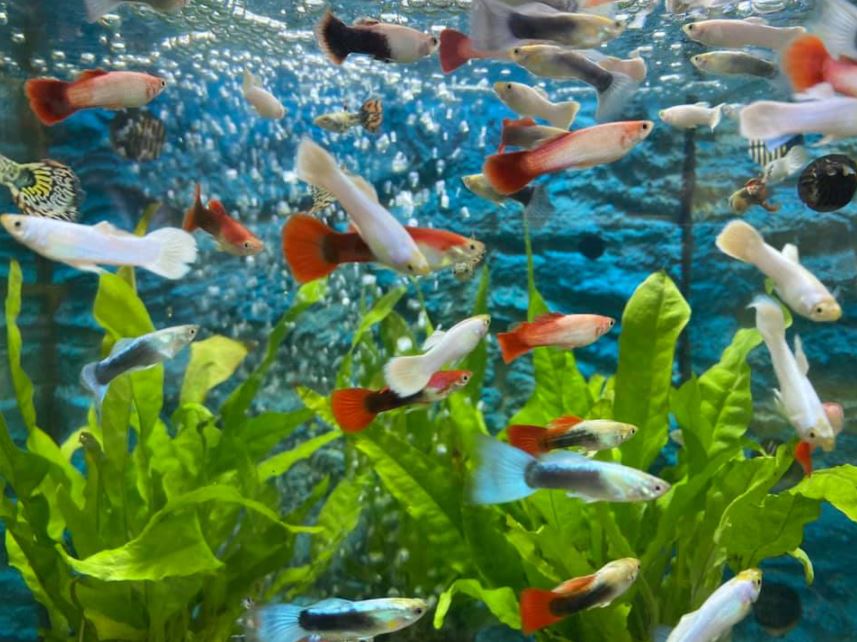
Where is `fish tank`? This screenshot has height=642, width=857. fish tank is located at coordinates (608, 288).